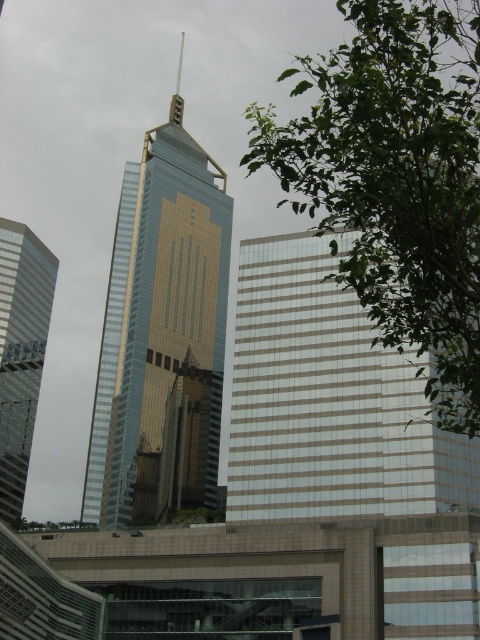
Question: In this image, where is white glass building at center located relative to silver reflective glass skyscraper at left?

Choices:
 (A) above
 (B) below

Answer: (A)

Question: Which is farther from the green leafy tree at center?

Choices:
 (A) gold reflective glass tower at center
 (B) silver reflective glass skyscraper at left

Answer: (B)

Question: Considering the relative positions of white glass building at center and silver reflective glass skyscraper at left in the image provided, where is white glass building at center located with respect to silver reflective glass skyscraper at left?

Choices:
 (A) above
 (B) below

Answer: (A)

Question: Which object is the farthest from the green leafy tree at center?

Choices:
 (A) white glass building at center
 (B) gold reflective glass tower at center
 (C) silver reflective glass skyscraper at left

Answer: (C)

Question: Can you confirm if green leafy tree at center is positioned to the left of silver reflective glass skyscraper at left?

Choices:
 (A) no
 (B) yes

Answer: (A)

Question: Which point is closer to the camera?

Choices:
 (A) white glass building at center
 (B) gold reflective glass tower at center

Answer: (A)